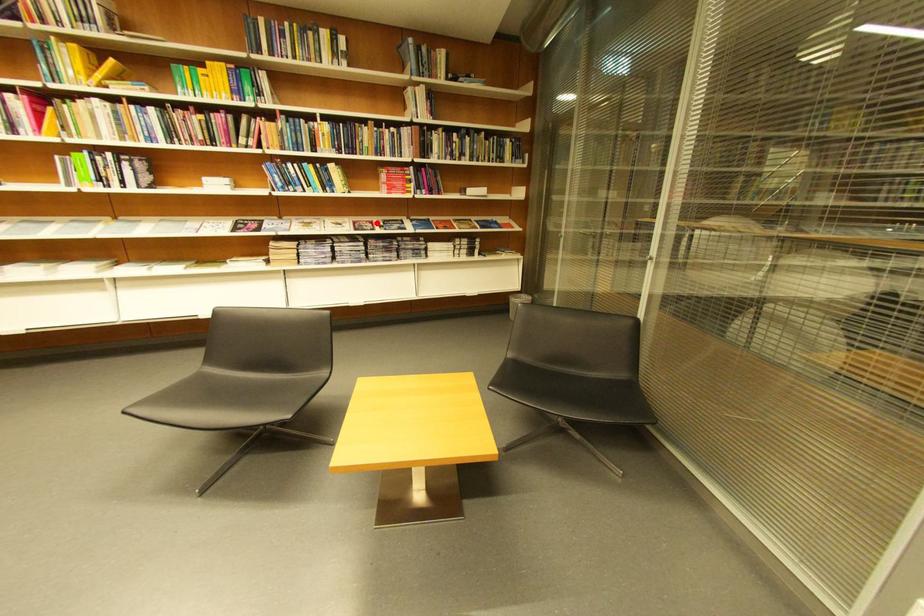
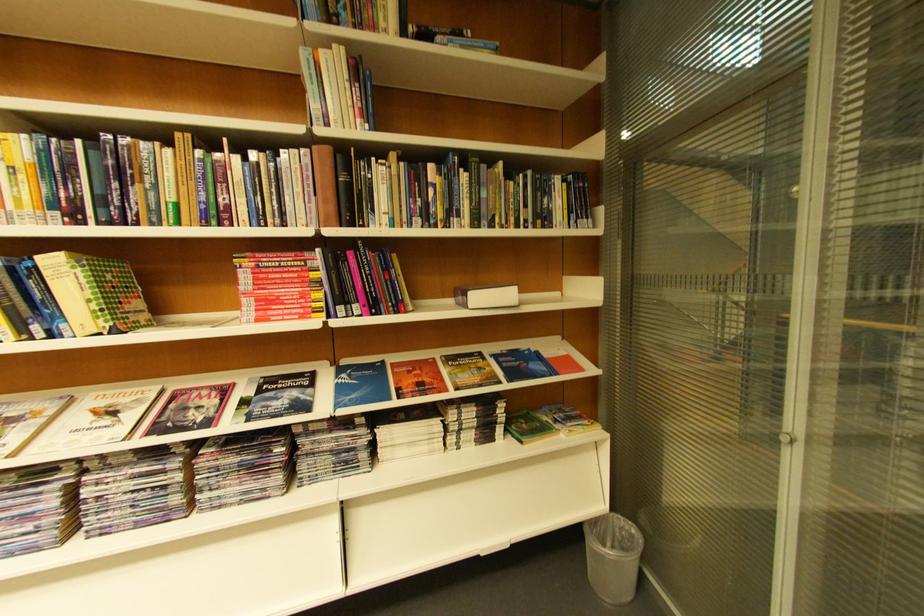
Question: I am providing you with two images of the same scene from different viewpoints. Given a red point in image1, look at the same physical point in image2. Is it:

Choices:
 (A) Closer to the viewpoint
 (B) Farther from the viewpoint

Answer: (B)